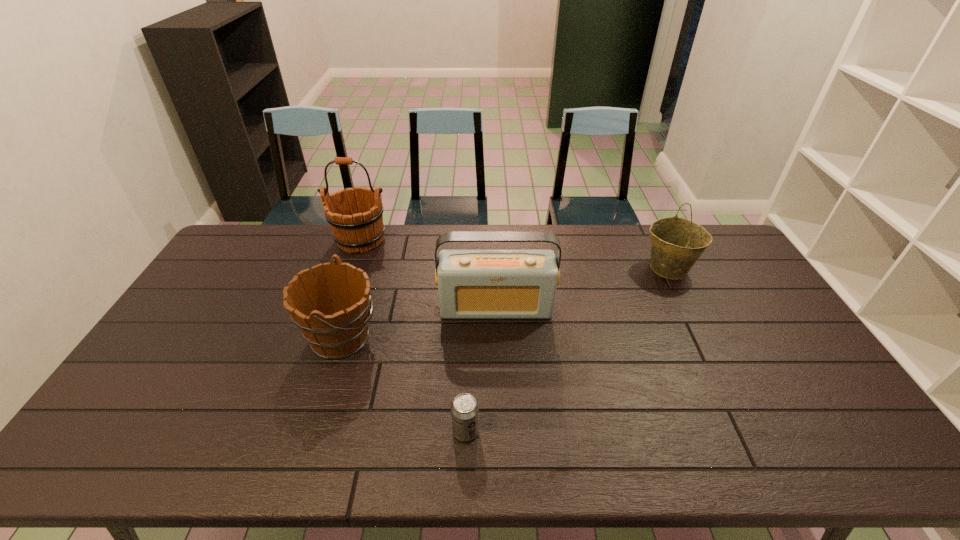
The image size is (960, 540). I want to click on the tallest wine bucket, so click(355, 216).

This screenshot has height=540, width=960. I want to click on radio receiver, so click(x=472, y=284).

This screenshot has width=960, height=540. I want to click on the rightmost object, so click(x=676, y=243).

You are a GUI agent. You are given a task and a screenshot of the screen. Output one action in this format:
    pyautogui.click(x=<x>, y=<y>)
    Task: Click on the nearest wine bucket
    
    Given the screenshot: What is the action you would take?
    pyautogui.click(x=333, y=335)

The image size is (960, 540). Identify the location of the second shortest object. (333, 335).

Where is `beer can`? The width and height of the screenshot is (960, 540). beer can is located at coordinates (464, 409).

You are a GUI agent. You are given a task and a screenshot of the screen. Output one action in this format:
    pyautogui.click(x=<x>, y=<y>)
    Task: Click on the shortest object
    The width and height of the screenshot is (960, 540).
    Given the screenshot: What is the action you would take?
    tap(464, 409)

I want to click on free location located 0.050m on the front of the tallest object, so click(x=352, y=266).

Locate an element on the screen. free space located on the front-facing side of the radio receiver is located at coordinates (499, 380).

Locate an element on the screen. Image resolution: width=960 pixels, height=540 pixels. vacant space located 0.240m on the left of the rightmost object is located at coordinates (572, 268).